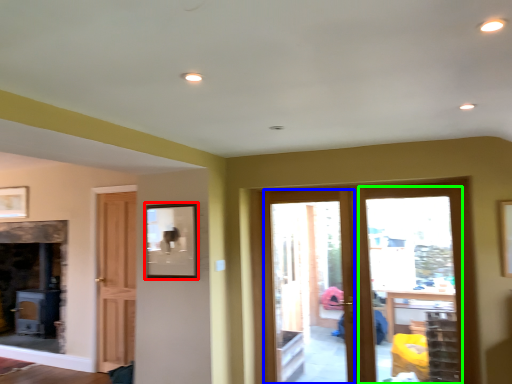
Question: Estimate the real-world distances between objects in this image. Which object is closer to picture frame (highlighted by a red box), screen door (highlighted by a blue box) or glass door (highlighted by a green box)?

Choices:
 (A) screen door
 (B) glass door

Answer: (B)